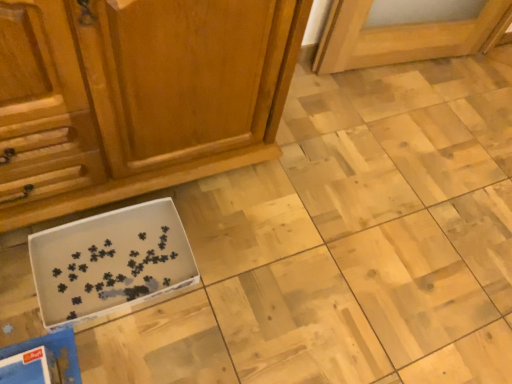
Image resolution: width=512 pixels, height=384 pixels. What do you see at coordinates (136, 96) in the screenshot?
I see `wooden cabinet at lower left` at bounding box center [136, 96].

This screenshot has height=384, width=512. Identify the location of wooden cabinet at lower left. (136, 96).

This screenshot has height=384, width=512. Describe the element at coordinates (110, 263) in the screenshot. I see `white cardboard box at lower left` at that location.

Locate an element on the screen. white cardboard box at lower left is located at coordinates (110, 263).

Find the location of `wooden cabinet at lower left`. wooden cabinet at lower left is located at coordinates (136, 96).

Does white cardboard box at lower left appear on the left side of wooden cabinet at lower left?

Indeed, white cardboard box at lower left is positioned on the left side of wooden cabinet at lower left.

Is white cardboard box at lower left positioned behind wooden cabinet at lower left?

Yes, it is.

Between point (83, 236) and point (224, 153), which one is positioned in front?

The point (83, 236) is closer to the camera.

From the image's perspective, is white cardboard box at lower left on wooden cabinet at lower left?

No, from the image's perspective, white cardboard box at lower left is not above wooden cabinet at lower left.

From a real-world perspective, is white cardboard box at lower left physically located above or below wooden cabinet at lower left?

Clearly, from a real-world perspective, white cardboard box at lower left is below wooden cabinet at lower left.

Considering the sizes of objects white cardboard box at lower left and wooden cabinet at lower left in the image provided, who is thinner, white cardboard box at lower left or wooden cabinet at lower left?

white cardboard box at lower left is thinner.

Considering the relative sizes of white cardboard box at lower left and wooden cabinet at lower left in the image provided, is white cardboard box at lower left shorter than wooden cabinet at lower left?

Yes, white cardboard box at lower left is shorter than wooden cabinet at lower left.

Who is smaller, white cardboard box at lower left or wooden cabinet at lower left?

With smaller size is white cardboard box at lower left.

Is white cardboard box at lower left not inside wooden cabinet at lower left?

That's correct, white cardboard box at lower left is outside of wooden cabinet at lower left.

Are white cardboard box at lower left and wooden cabinet at lower left making contact?

white cardboard box at lower left and wooden cabinet at lower left are not in contact.

Is white cardboard box at lower left facing towards wooden cabinet at lower left?

No, white cardboard box at lower left is not turned towards wooden cabinet at lower left.

How different are the orientations of white cardboard box at lower left and wooden cabinet at lower left in degrees?

The angle between the facing direction of white cardboard box at lower left and the facing direction of wooden cabinet at lower left is 1.36 degrees.

Locate an element on the screen. cardboard box below the wooden cabinet at lower left (from a real-world perspective) is located at coordinates (110, 263).

Can you confirm if wooden cabinet at lower left is positioned to the left of white cardboard box at lower left?

No, wooden cabinet at lower left is not to the left of white cardboard box at lower left.

In the image, is wooden cabinet at lower left positioned in front of or behind white cardboard box at lower left?

In the image, wooden cabinet at lower left appears in front of white cardboard box at lower left.

Is point (8, 172) positioned in front of point (113, 297)?

Yes.

From the image's perspective, which is below, wooden cabinet at lower left or white cardboard box at lower left?

From the image's view, white cardboard box at lower left is below.

From a real-world perspective, is wooden cabinet at lower left physically located above or below white cardboard box at lower left?

From a real-world perspective, wooden cabinet at lower left is physically above white cardboard box at lower left.

Considering the sizes of objects wooden cabinet at lower left and white cardboard box at lower left in the image provided, who is wider, wooden cabinet at lower left or white cardboard box at lower left?

Wider between the two is wooden cabinet at lower left.

Between wooden cabinet at lower left and white cardboard box at lower left, which one has less height?

Standing shorter between the two is white cardboard box at lower left.

Is wooden cabinet at lower left bigger or smaller than white cardboard box at lower left?

Clearly, wooden cabinet at lower left is larger in size than white cardboard box at lower left.

Is wooden cabinet at lower left situated inside white cardboard box at lower left or outside?

wooden cabinet at lower left exists outside the volume of white cardboard box at lower left.

Is wooden cabinet at lower left far from white cardboard box at lower left?

No, wooden cabinet at lower left is not far away from white cardboard box at lower left.

Is wooden cabinet at lower left aimed at white cardboard box at lower left?

Yes, wooden cabinet at lower left is turned towards white cardboard box at lower left.

Where is `cabinetry on the right of white cardboard box at lower left`? This screenshot has height=384, width=512. cabinetry on the right of white cardboard box at lower left is located at coordinates (136, 96).

The width and height of the screenshot is (512, 384). Find the location of `cabinetry that appears above the white cardboard box at lower left (from the image's perspective)`. cabinetry that appears above the white cardboard box at lower left (from the image's perspective) is located at coordinates (136, 96).

Find the location of a particular element. cabinetry on the right side of white cardboard box at lower left is located at coordinates (136, 96).